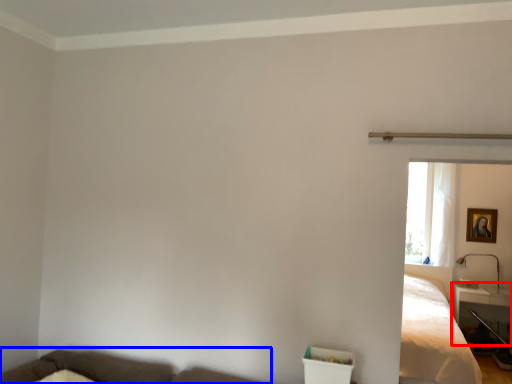
Question: Which point is closer to the camera, table (highlighted by a red box) or couch (highlighted by a blue box)?

Choices:
 (A) table
 (B) couch

Answer: (B)